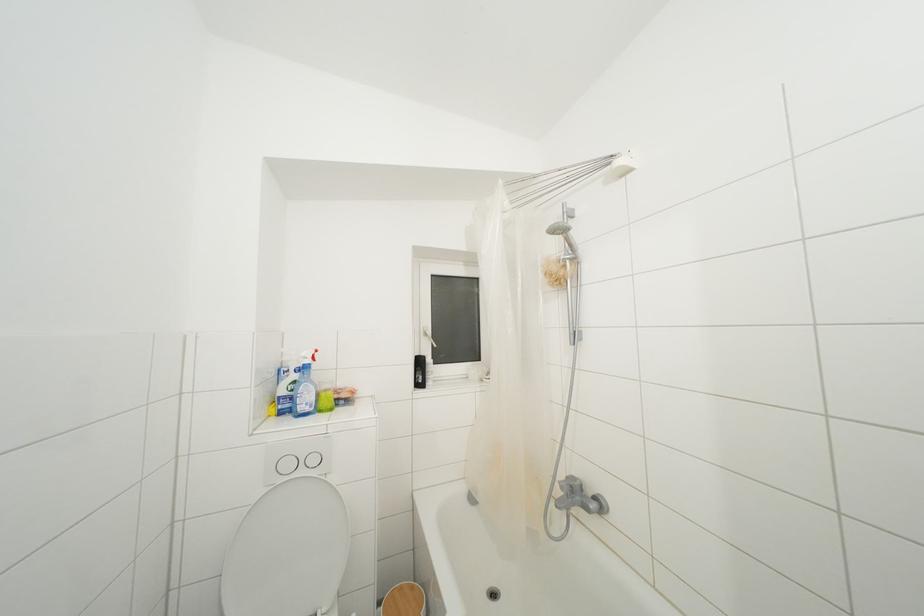
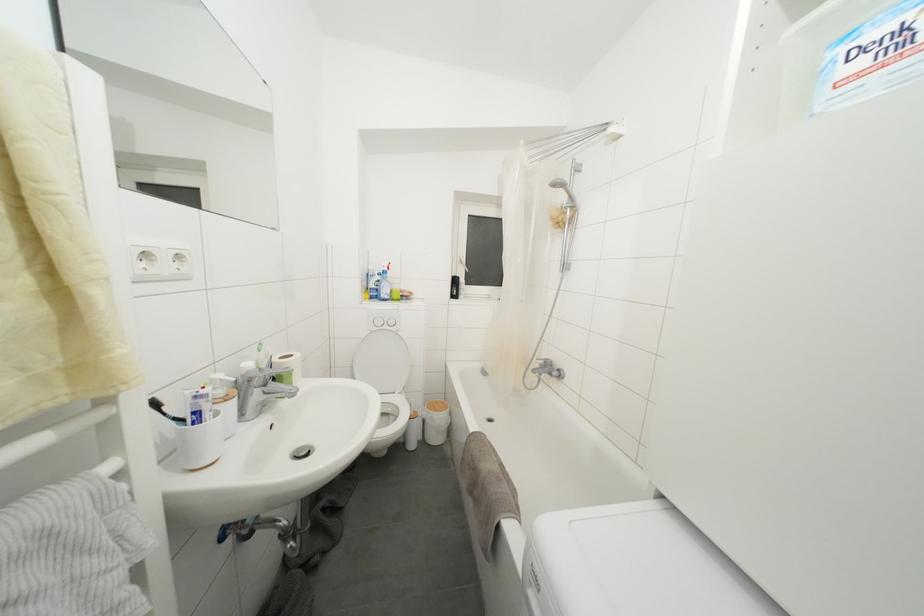
Question: How did the camera likely rotate?

Choices:
 (A) Left
 (B) Right
 (C) Up
 (D) Down

Answer: (D)